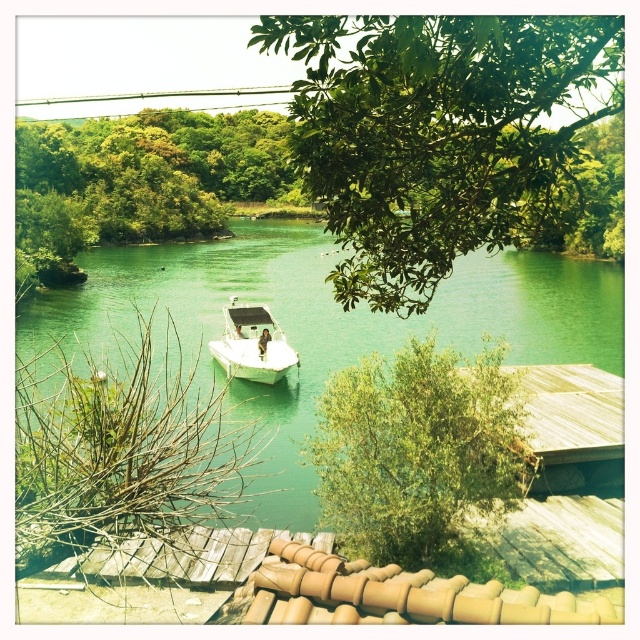
You are planning to place a 2.5 meters wide picnic blanket on the green glossy water at center and the green leafy tree at center. Which location would allow the blanket to fit without overlapping?

The green glossy water at center is wider than the green leafy tree at center, so placing the picnic blanket on the green glossy water at center would allow it to fit without overlapping.

In the scene shown: You are standing on the dock and see the green glossy water at center and the white glossy boat at center. Which object is closer to you?

The white glossy boat at center is closer to you because the green glossy water at center is positioned over it, meaning the boat is beneath the water and thus closer to your position on the dock.